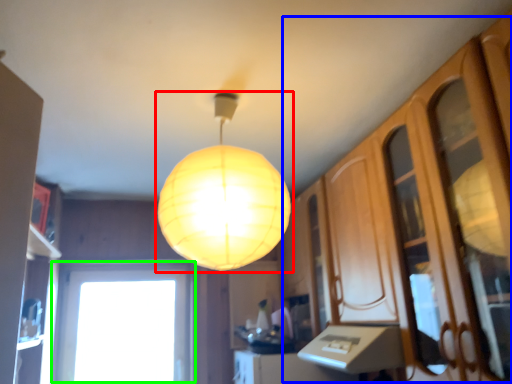
Question: Which object is positioned farthest from lamp (highlighted by a red box)? Select from dresser (highlighted by a blue box) and window (highlighted by a green box).

Choices:
 (A) dresser
 (B) window

Answer: (B)